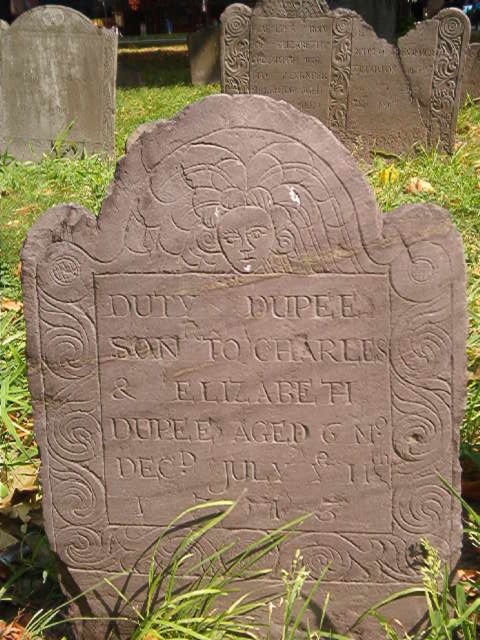
Question: Among these points, which one is farthest from the camera?

Choices:
 (A) (226, 16)
 (B) (230, 324)
 (C) (98, 96)

Answer: (C)

Question: Is black stone inscription at center positioned before dark gray stone gravestone at upper left?

Choices:
 (A) yes
 (B) no

Answer: (A)

Question: Which point is farther from the camera taking this photo?

Choices:
 (A) (468, 24)
 (B) (226, 452)
 (C) (84, 113)

Answer: (C)

Question: Is black stone inscription at center positioned in front of dark gray stone gravestone at upper left?

Choices:
 (A) yes
 (B) no

Answer: (A)

Question: Is black stone inscription at center to the right of dark gray stone gravestone at upper left from the viewer's perspective?

Choices:
 (A) no
 (B) yes

Answer: (B)

Question: Among these objects, which one is farthest from the camera?

Choices:
 (A) black stone inscription at center
 (B) dark gray stone gravestone at upper left

Answer: (B)